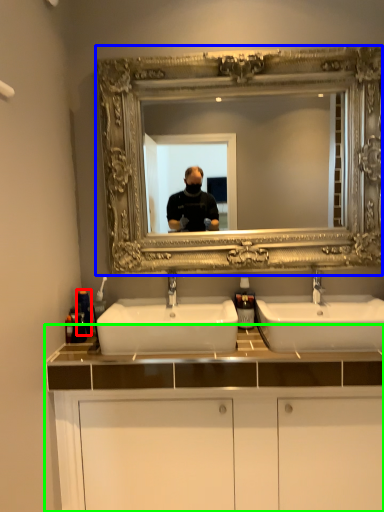
Question: Which object is the farthest from toiletry (highlighted by a red box)? Choose among these: medicine cabinet (highlighted by a blue box) or bathroom cabinet (highlighted by a green box).

Choices:
 (A) medicine cabinet
 (B) bathroom cabinet

Answer: (A)